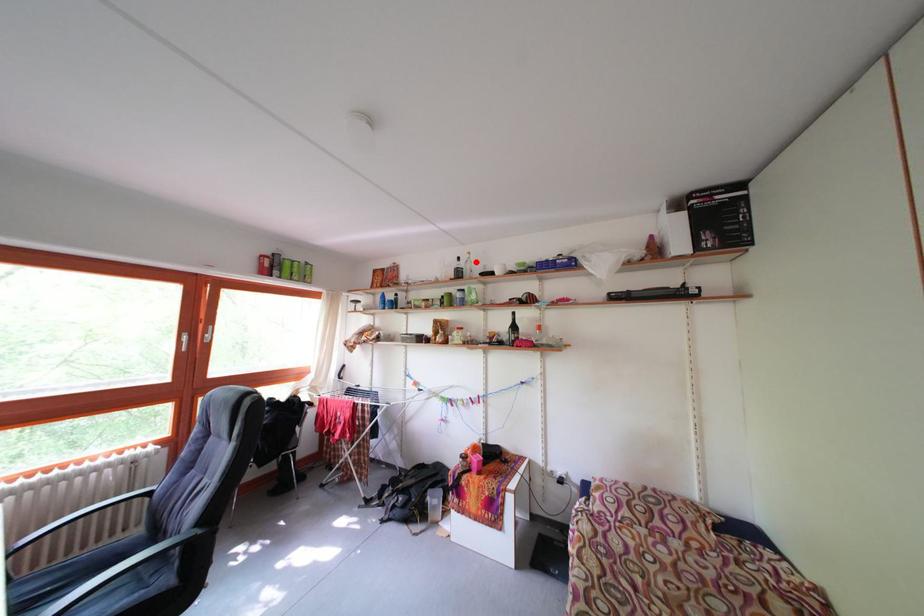
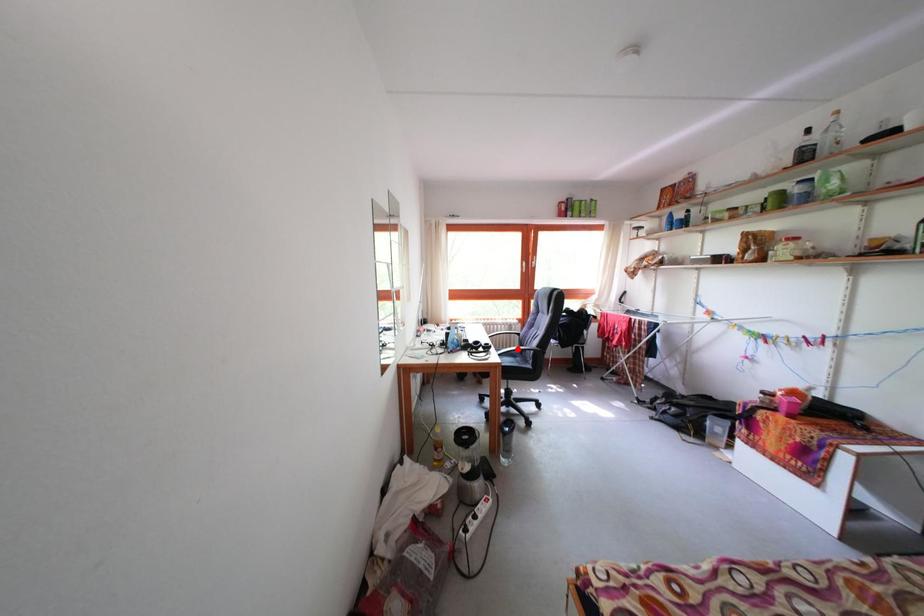
I am providing you with two images of the same scene from different viewpoints. A red point is marked on the first image and another point is marked on the second image. Are the points marked in image1 and image2 representing the same 3D position?

No